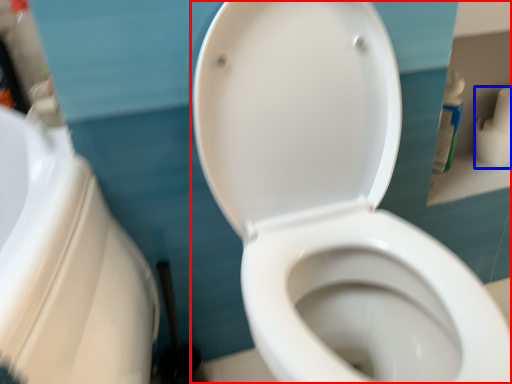
Question: Which point is further to the camera, toilet (highlighted by a red box) or toilet paper (highlighted by a blue box)?

Choices:
 (A) toilet
 (B) toilet paper

Answer: (B)